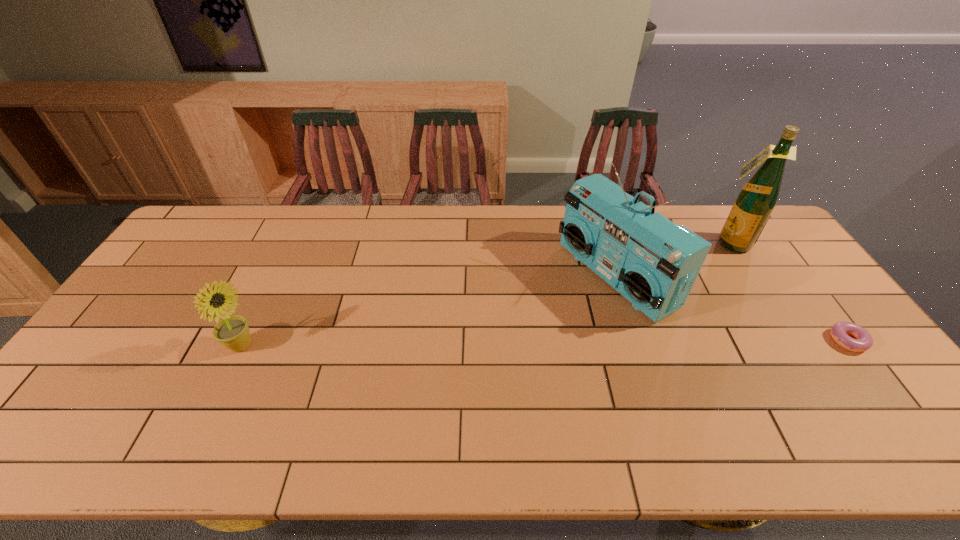
Find the location of a particular element. vacant area located on the front-facing side of the third object from right to left is located at coordinates (545, 319).

Find the location of a particular element. The width and height of the screenshot is (960, 540). blank area located on the front-facing side of the third object from right to left is located at coordinates (540, 321).

Image resolution: width=960 pixels, height=540 pixels. Identify the location of free location located 0.210m on the front-facing side of the third object from right to left. [516, 334].

In order to click on free location located 0.050m on the front-facing side of the liquor in this screenshot , I will do `click(712, 258)`.

I want to click on vacant region located on the front-facing side of the liquor, so click(x=703, y=268).

You are a GUI agent. You are given a task and a screenshot of the screen. Output one action in this format:
    pyautogui.click(x=<x>, y=<y>)
    Task: Click on the vacant space located on the front-facing side of the liquor
    This screenshot has height=540, width=960.
    Given the screenshot: What is the action you would take?
    pyautogui.click(x=695, y=276)

What are the coordinates of `radio receiver present at the far edge` in the screenshot? It's located at (652, 262).

Where is `liquor present at the far edge`? This screenshot has width=960, height=540. liquor present at the far edge is located at coordinates (755, 202).

Image resolution: width=960 pixels, height=540 pixels. In order to click on doughnut that is at the right edge in this screenshot , I will do `click(863, 340)`.

This screenshot has height=540, width=960. Identify the location of liquor at the right edge. (755, 202).